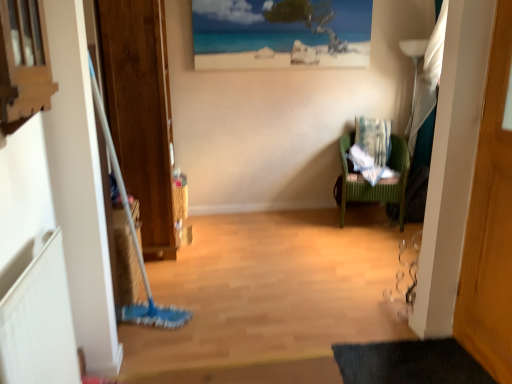
Locate an element on the screen. free space between green plastic chair at right and wooden screen door at left is located at coordinates (266, 228).